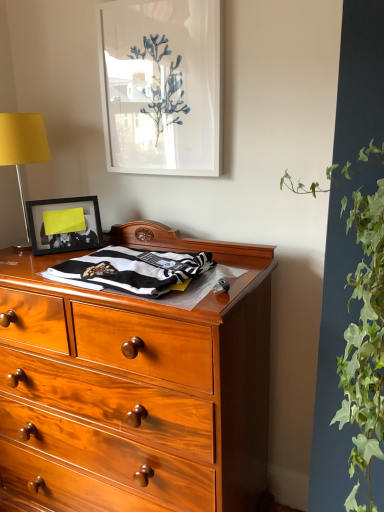
Where is `yellow fabric lampshade at left`? Image resolution: width=384 pixels, height=512 pixels. yellow fabric lampshade at left is located at coordinates (23, 150).

This screenshot has width=384, height=512. In order to click on matte black picture frame at upper left, the second picture frame in the right-to-left sequence in this screenshot , I will do `click(64, 225)`.

Describe the element at coordinates (132, 270) in the screenshot. The height and width of the screenshot is (512, 384). I see `black and white striped fabric at center` at that location.

Measure the distance between green leafy plant at right and camera.

green leafy plant at right and camera are 24.55 inches apart from each other.

Identify the location of white glossy picture frame at upper center, the 1th picture frame in the top-to-bottom sequence. The image size is (384, 512). (162, 86).

Identify the location of yellow fabric lampshade at left. (23, 150).

In terms of width, does white glossy picture frame at upper center, positioned as the second picture frame in bottom-to-top order, look wider or thinner when compared to green leafy plant at right?

white glossy picture frame at upper center, positioned as the second picture frame in bottom-to-top order, is thinner than green leafy plant at right.

Which is nearer, [209,24] or [351,471]?

Point [351,471]

From the image's perspective, would you say white glossy picture frame at upper center, positioned as the second picture frame in bottom-to-top order, is shown under green leafy plant at right?

No, from the image's perspective, white glossy picture frame at upper center, positioned as the second picture frame in bottom-to-top order, is not beneath green leafy plant at right.

Is white glossy picture frame at upper center, positioned as the second picture frame in bottom-to-top order, further to camera compared to green leafy plant at right?

Yes, it is.

Does black and white striped fabric at center have a lesser height compared to green leafy plant at right?

Yes, black and white striped fabric at center is shorter than green leafy plant at right.

Is green leafy plant at right a part of black and white striped fabric at center?

No, green leafy plant at right is not a part of black and white striped fabric at center.

Can you confirm if black and white striped fabric at center is positioned to the left of green leafy plant at right?

Yes, black and white striped fabric at center is to the left of green leafy plant at right.

Is white glossy picture frame at upper center, positioned as the second picture frame in bottom-to-top order, wider than yellow fabric lampshade at left?

No, white glossy picture frame at upper center, positioned as the second picture frame in bottom-to-top order, is not wider than yellow fabric lampshade at left.

From the image's perspective, does white glossy picture frame at upper center, the 1th picture frame in the top-to-bottom sequence, appear higher than yellow fabric lampshade at left?

Correct, white glossy picture frame at upper center, the 1th picture frame in the top-to-bottom sequence, appears higher than yellow fabric lampshade at left in the image.

Identify the location of table lamp below the white glossy picture frame at upper center, arranged as the 1th picture frame when viewed from the right (from the image's perspective). (23, 150).

Based on their sizes in the image, would you say white glossy picture frame at upper center, positioned as the second picture frame in bottom-to-top order, is bigger or smaller than yellow fabric lampshade at left?

Clearly, white glossy picture frame at upper center, positioned as the second picture frame in bottom-to-top order, is smaller in size than yellow fabric lampshade at left.

The width and height of the screenshot is (384, 512). I want to click on table lamp that appears behind the white glossy picture frame at upper center, arranged as the 1th picture frame when viewed from the right, so click(x=23, y=150).

From a real-world perspective, who is located lower, yellow fabric lampshade at left or white glossy picture frame at upper center, marked as the second picture frame in a left-to-right arrangement?

A: yellow fabric lampshade at left is physically lower.

Based on their sizes in the image, would you say yellow fabric lampshade at left is bigger or smaller than white glossy picture frame at upper center, positioned as the second picture frame in bottom-to-top order?

Clearly, yellow fabric lampshade at left is larger in size than white glossy picture frame at upper center, positioned as the second picture frame in bottom-to-top order.

Does point (40, 145) come behind point (124, 113)?

No, it is in front of (124, 113).

Can you see black and white striped fabric at center touching matte black picture frame at upper left, the second picture frame in the right-to-left sequence?

black and white striped fabric at center is not next to matte black picture frame at upper left, the second picture frame in the right-to-left sequence, and they're not touching.

Does black and white striped fabric at center turn towards matte black picture frame at upper left, the second picture frame in the right-to-left sequence?

No, black and white striped fabric at center is not oriented towards matte black picture frame at upper left, the second picture frame in the right-to-left sequence.

The width and height of the screenshot is (384, 512). Identify the location of the 2nd picture frame behind when counting from the black and white striped fabric at center. (64, 225).

Is matte black picture frame at upper left, placed as the 2th picture frame when sorted from top to bottom, inside the boundaries of yellow fabric lampshade at left, or outside?

matte black picture frame at upper left, placed as the 2th picture frame when sorted from top to bottom, cannot be found inside yellow fabric lampshade at left.

From the image's perspective, which is above, matte black picture frame at upper left, placed as the 2th picture frame when sorted from top to bottom, or yellow fabric lampshade at left?

yellow fabric lampshade at left, from the image's perspective.

Based on the photo, does matte black picture frame at upper left, the second picture frame in the right-to-left sequence, touch yellow fabric lampshade at left?

No, matte black picture frame at upper left, the second picture frame in the right-to-left sequence, is not making contact with yellow fabric lampshade at left.

Which is more to the right, matte black picture frame at upper left, the second picture frame in the right-to-left sequence, or yellow fabric lampshade at left?

Positioned to the right is matte black picture frame at upper left, the second picture frame in the right-to-left sequence.

Can you confirm if matte black picture frame at upper left, which appears as the 1th picture frame when ordered from the bottom, is wider than white glossy picture frame at upper center, marked as the second picture frame in a left-to-right arrangement?

Yes.

Is point (54, 251) closer or farther from the camera than point (141, 163)?

Point (54, 251) is positioned closer to the camera compared to point (141, 163).

Is matte black picture frame at upper left, which appears as the 1th picture frame when ordered from the bottom, far from white glossy picture frame at upper center, marked as the second picture frame in a left-to-right arrangement?

Actually, matte black picture frame at upper left, which appears as the 1th picture frame when ordered from the bottom, and white glossy picture frame at upper center, marked as the second picture frame in a left-to-right arrangement, are a little close together.

Measure the distance between matte black picture frame at upper left, the second picture frame in the right-to-left sequence, and white glossy picture frame at upper center, the 1th picture frame in the top-to-bottom sequence.

They are 16.43 inches apart.

Find the location of a particular element. vegetation in front of the white glossy picture frame at upper center, the 1th picture frame in the top-to-bottom sequence is located at coordinates coord(364,343).

This screenshot has width=384, height=512. What are the coordinates of `vegetation that is under the black and white striped fabric at center (from a real-world perspective)` in the screenshot? It's located at (364, 343).

Which object lies nearer to the anchor point black and white striped fabric at center, white glossy picture frame at upper center, arranged as the 1th picture frame when viewed from the right, or matte black picture frame at upper left, the first picture frame from the left?

The object closer to black and white striped fabric at center is matte black picture frame at upper left, the first picture frame from the left.

Based on their spatial positions, is yellow fabric lampshade at left or matte black picture frame at upper left, the first picture frame from the left, closer to white glossy picture frame at upper center, the 1th picture frame in the top-to-bottom sequence?

The object closer to white glossy picture frame at upper center, the 1th picture frame in the top-to-bottom sequence, is yellow fabric lampshade at left.

Estimate the real-world distances between objects in this image. Which object is closer to yellow fabric lampshade at left, matte black picture frame at upper left, which appears as the 1th picture frame when ordered from the bottom, or green leafy plant at right?

matte black picture frame at upper left, which appears as the 1th picture frame when ordered from the bottom, lies closer to yellow fabric lampshade at left than the other object.

Estimate the real-world distances between objects in this image. Which object is closer to green leafy plant at right, matte black picture frame at upper left, the second picture frame in the right-to-left sequence, or white glossy picture frame at upper center, marked as the second picture frame in a left-to-right arrangement?

white glossy picture frame at upper center, marked as the second picture frame in a left-to-right arrangement, is closer to green leafy plant at right.

Looking at this image, which object lies further to the anchor point green leafy plant at right, white glossy picture frame at upper center, marked as the second picture frame in a left-to-right arrangement, or black and white striped fabric at center?

white glossy picture frame at upper center, marked as the second picture frame in a left-to-right arrangement, is positioned further to the anchor green leafy plant at right.

Considering their positions, is matte black picture frame at upper left, which appears as the 1th picture frame when ordered from the bottom, positioned further to green leafy plant at right than yellow fabric lampshade at left?

Based on the image, yellow fabric lampshade at left appears to be further to green leafy plant at right.

From the image, which object appears to be farther from black and white striped fabric at center, green leafy plant at right or white glossy picture frame at upper center, marked as the second picture frame in a left-to-right arrangement?

Based on the image, white glossy picture frame at upper center, marked as the second picture frame in a left-to-right arrangement, appears to be further to black and white striped fabric at center.

Estimate the real-world distances between objects in this image. Which object is closer to matte black picture frame at upper left, which appears as the 1th picture frame when ordered from the bottom, white glossy picture frame at upper center, positioned as the second picture frame in bottom-to-top order, or green leafy plant at right?

The object closer to matte black picture frame at upper left, which appears as the 1th picture frame when ordered from the bottom, is white glossy picture frame at upper center, positioned as the second picture frame in bottom-to-top order.

This screenshot has width=384, height=512. In order to click on picture frame between yellow fabric lampshade at left and black and white striped fabric at center in this screenshot , I will do pos(64,225).

What are the coordinates of `picture frame between green leafy plant at right and matte black picture frame at upper left, the second picture frame in the right-to-left sequence, in the front-back direction` in the screenshot? It's located at (162, 86).

Where is `table lamp between white glossy picture frame at upper center, arranged as the 1th picture frame when viewed from the right, and black and white striped fabric at center, in the vertical direction`? Image resolution: width=384 pixels, height=512 pixels. table lamp between white glossy picture frame at upper center, arranged as the 1th picture frame when viewed from the right, and black and white striped fabric at center, in the vertical direction is located at coordinates (23, 150).

This screenshot has height=512, width=384. I want to click on picture frame between white glossy picture frame at upper center, positioned as the second picture frame in bottom-to-top order, and black and white striped fabric at center, in the vertical direction, so click(x=64, y=225).